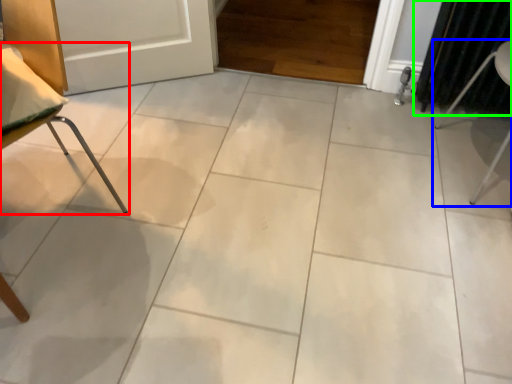
Question: Based on their relative distances, which object is nearer to furniture (highlighted by a red box)? Choose from furniture (highlighted by a blue box) and curtain (highlighted by a green box).

Choices:
 (A) furniture
 (B) curtain

Answer: (B)